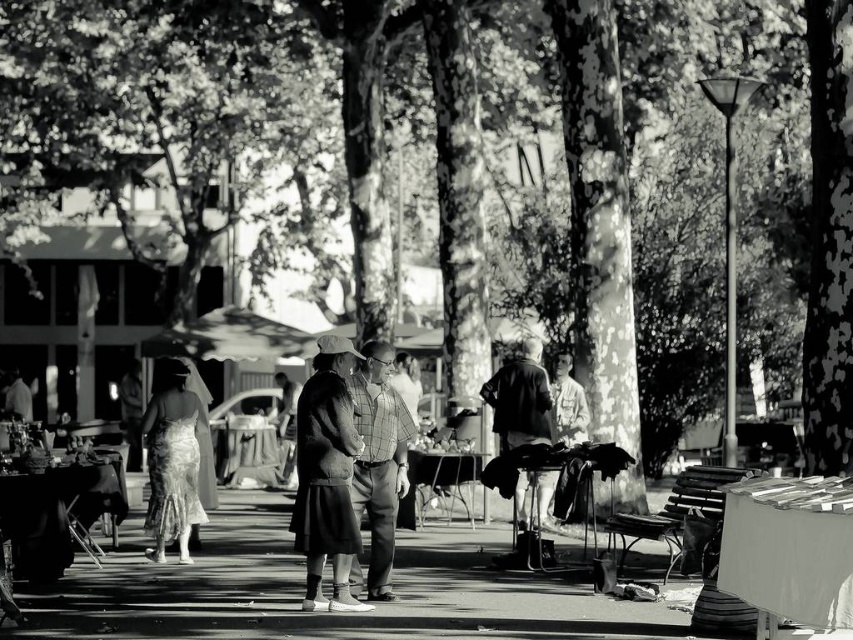
You are a photographer trying to capture both the checkered fabric shirt at center and the silky white dress at center in a single frame. Based on their sizes, which one would you need to position closer to the camera to ensure both appear equally large in the photo?

The checkered fabric shirt at center occupies less space than the silky white dress at center, so you should position the checkered fabric shirt at center closer to the camera to make them appear the same size in the photo.

Based on the scene described, which clothing item is positioned lower on the person wearing them? The checkered fabric shirt at center or the light brown textured jacket at center?

The checkered fabric shirt at center is positioned lower than the light brown textured jacket at center, as it is described to be below it.